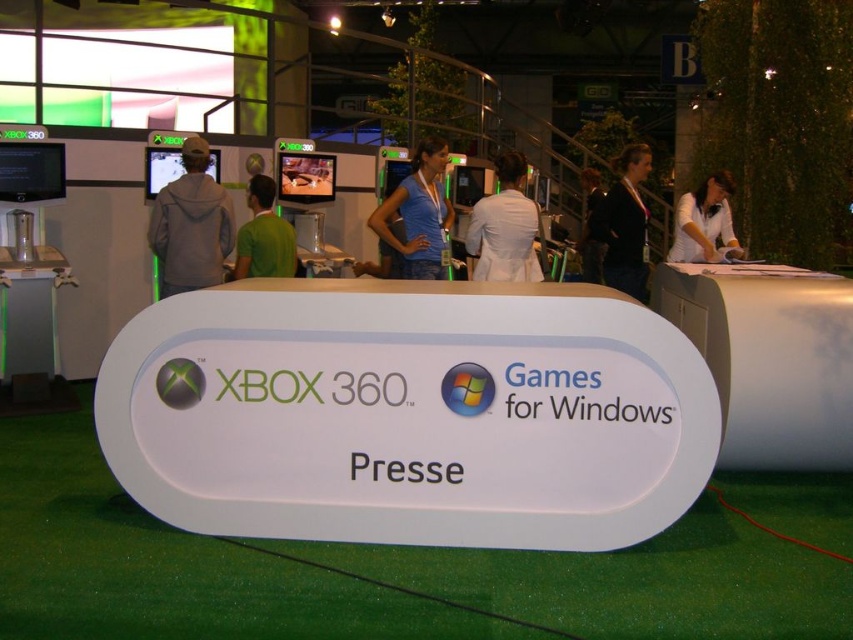
Question: Is transparent glass circle at center below light blue shirt at center?

Choices:
 (A) yes
 (B) no

Answer: (A)

Question: Considering the real-world distances, which object is farthest from the green matte shirt at center?

Choices:
 (A) transparent glass circle at center
 (B) black fabric jacket at upper right
 (C) blue cotton shirt at center
 (D) metallic xbox logo at center

Answer: (A)

Question: Which point is closer to the camera?

Choices:
 (A) white lab coat at center
 (B) transparent glass circle at center

Answer: (B)

Question: Among these objects, which one is farthest from the camera?

Choices:
 (A) black fabric jacket at upper right
 (B) transparent glass circle at center

Answer: (A)

Question: Can you confirm if gray hoodie at left is thinner than green matte shirt at center?

Choices:
 (A) no
 (B) yes

Answer: (A)

Question: Does green matte shirt at center appear over transparent glass circle at center?

Choices:
 (A) no
 (B) yes

Answer: (B)